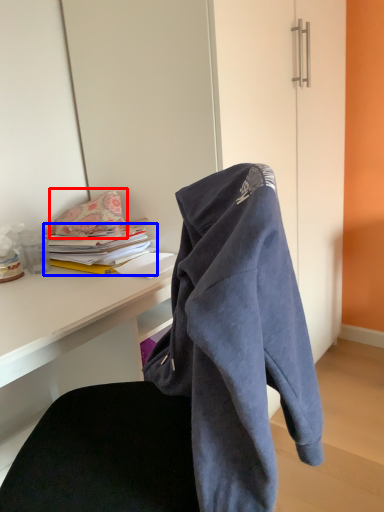
Question: Which of the following is the farthest to the observer, pillow (highlighted by a red box) or book (highlighted by a blue box)?

Choices:
 (A) pillow
 (B) book

Answer: (A)